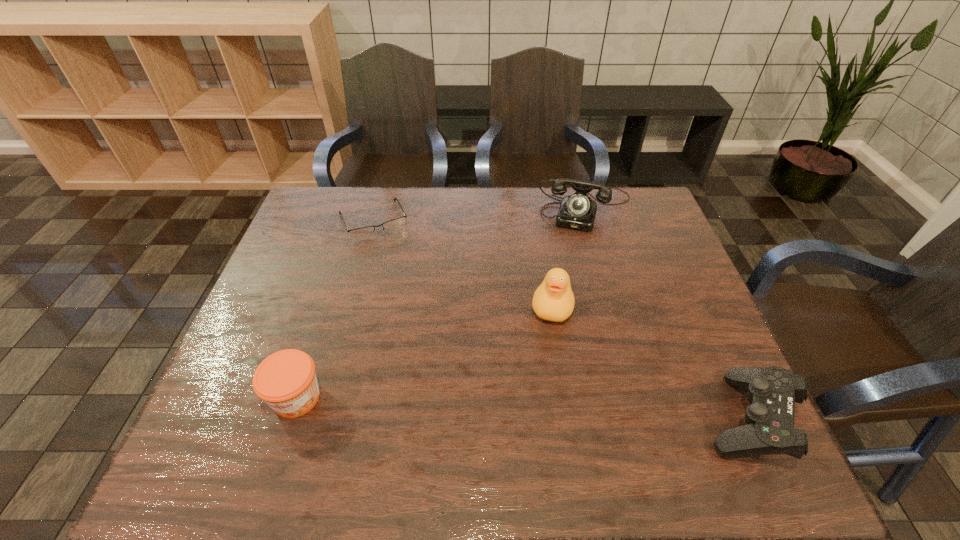
This screenshot has width=960, height=540. I want to click on jam located at the left edge, so click(x=286, y=380).

You are a GUI agent. You are given a task and a screenshot of the screen. Output one action in this format:
    pyautogui.click(x=<x>, y=<y>)
    Task: Click on the spectacles positioned at the left edge
    
    Given the screenshot: What is the action you would take?
    pyautogui.click(x=393, y=225)

Find the location of a particular element. This screenshot has height=540, width=960. control that is at the right edge is located at coordinates (769, 429).

Identify the location of telephone at the right edge. The width and height of the screenshot is (960, 540). (577, 211).

Where is `object situated at the far left corner`? This screenshot has width=960, height=540. object situated at the far left corner is located at coordinates (393, 225).

The width and height of the screenshot is (960, 540). I want to click on object that is positioned at the near left corner, so click(286, 380).

Identify the location of object located in the far right corner section of the desktop. (577, 211).

Locate an element on the screen. Image resolution: width=960 pixels, height=540 pixels. object that is at the near right corner is located at coordinates (769, 429).

Locate an element on the screen. The width and height of the screenshot is (960, 540). vacant space at the far edge of the desktop is located at coordinates (545, 202).

The width and height of the screenshot is (960, 540). Identify the location of vacant space at the near edge of the desktop. (503, 388).